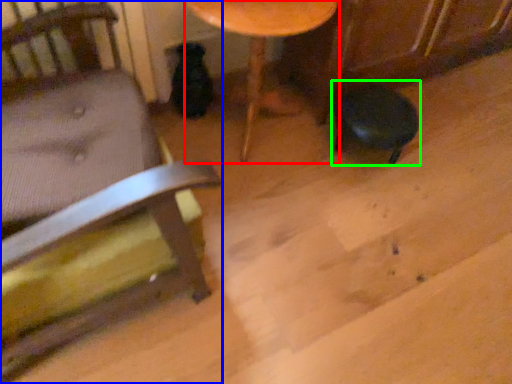
Question: Which object is the closest to the table (highlighted by a red box)? Choose among these: chair (highlighted by a blue box) or bar stool (highlighted by a green box).

Choices:
 (A) chair
 (B) bar stool

Answer: (B)